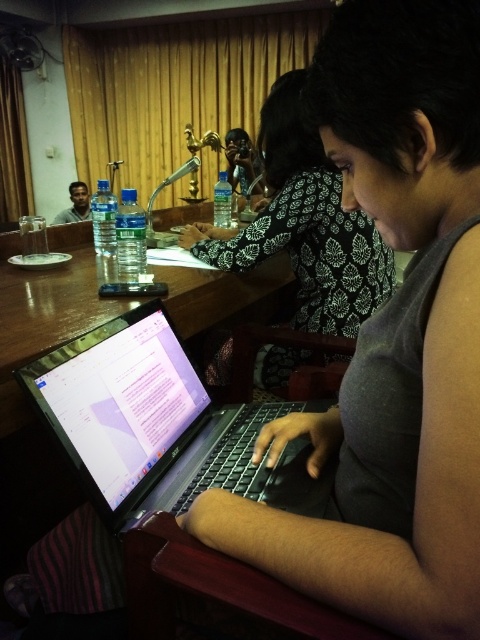
Is black printed blouse at center wider than matte black laptop at left?

Yes.

Does black printed blouse at center appear on the right side of matte black laptop at left?

Indeed, black printed blouse at center is positioned on the right side of matte black laptop at left.

Is point (367, 284) positioned after point (81, 214)?

That is False.

Locate an element on the screen. The height and width of the screenshot is (640, 480). black printed blouse at center is located at coordinates (303, 225).

Can you confirm if black glossy laptop at center is positioned below matte black laptop at left?

Yes, black glossy laptop at center is below matte black laptop at left.

Who is lower down, black glossy laptop at center or matte black laptop at left?

black glossy laptop at center

Between point (173, 504) and point (80, 205), which one is positioned in front?

Point (173, 504) is more forward.

This screenshot has width=480, height=640. I want to click on black glossy laptop at center, so click(160, 424).

What do you see at coordinates (47, 314) in the screenshot?
I see `wooden table at center` at bounding box center [47, 314].

Is point (252, 298) farther from viewer compared to point (88, 211)?

No, it is in front of (88, 211).

Between point (225, 308) and point (84, 200), which one is positioned in front?

Point (225, 308)

At what (x,y) coordinates should I click in order to perform the action: click on wooden table at center. Please return your answer as a coordinate pair (x, y). Looking at the image, I should click on pos(47,314).